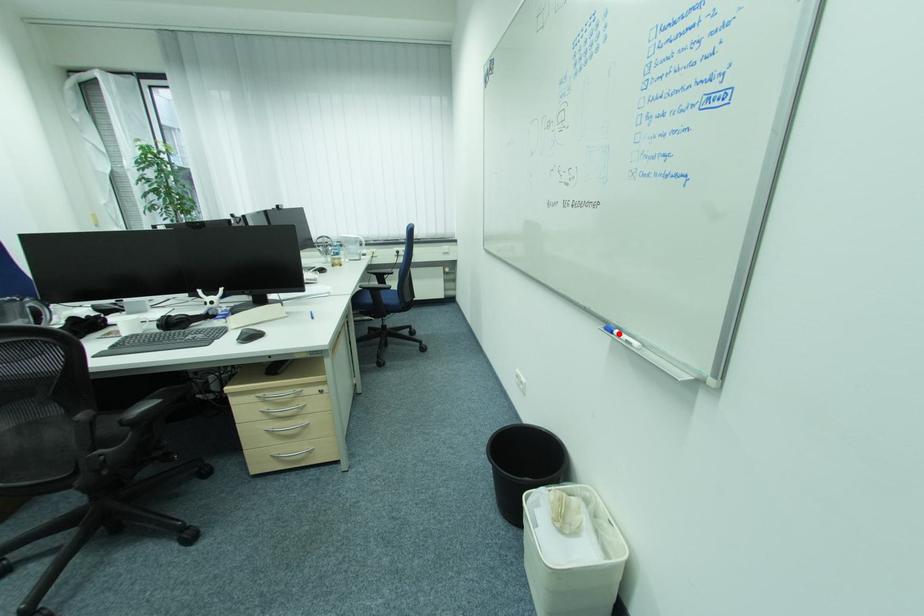
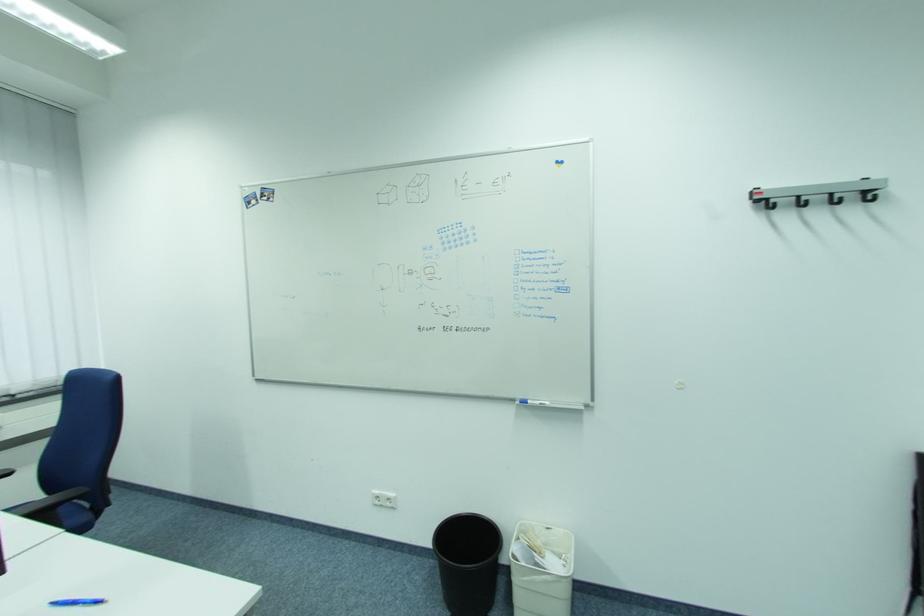
In the second image, find the point that corresponds to the highlighted location in the first image.

(533, 403)